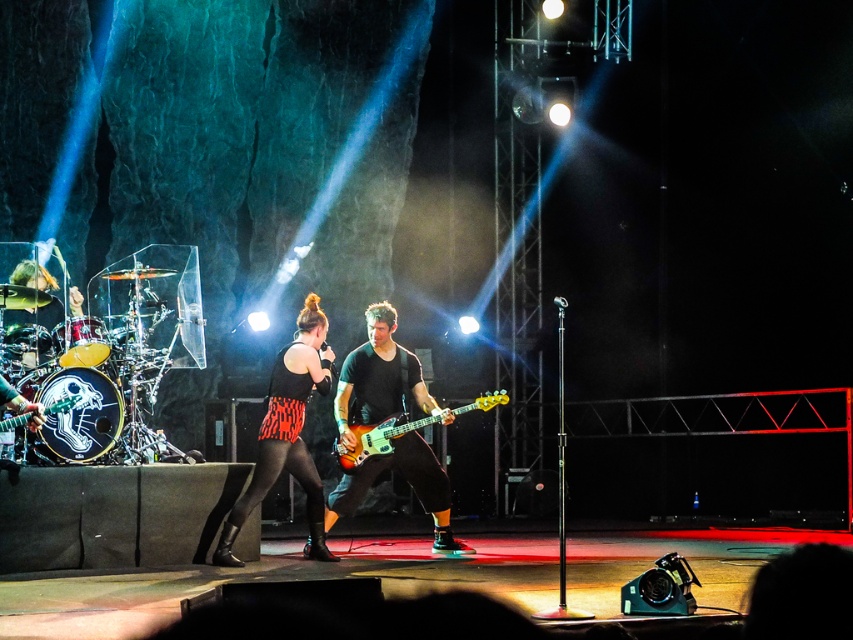
You are a stagehand who needs to adjust the lighting for the performance. The shiny orange bass guitar at center and the zebra print dress at center are both in the spotlight. If the spotlight has a diameter of 60 centimeters, will both items fit within the spotlight at the same time?

The shiny orange bass guitar at center is 54.36 centimeters from the zebra print dress at center. Since the distance between them is less than the spotlight diameter of 60 centimeters, both items can fit within the spotlight simultaneously.

You are a photographer standing in the audience and want to take a clear photo of the zebra print dress at center. The camera you have can focus on objects up to 20 feet away. Will you be able to capture the dress clearly?

The zebra print dress at center is 22.77 feet away from the viewer. Since the camera can only focus up to 20 feet, it won camera will not be able to capture the dress clearly.

You are a stagehand who needs to move the shiny orange bass guitar at center and the shiny orange wood bass guitar at center offstage. Which one requires more space to move due to its size?

The shiny orange bass guitar at center requires more space to move because it is larger in size than the shiny orange wood bass guitar at center.